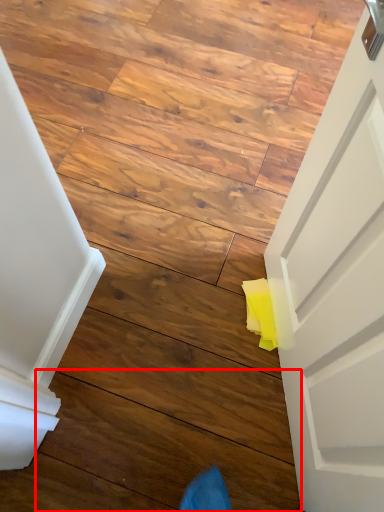
Question: From the image's perspective, where is plank (annotated by the red box) located relative to stairwell?

Choices:
 (A) above
 (B) below

Answer: (B)